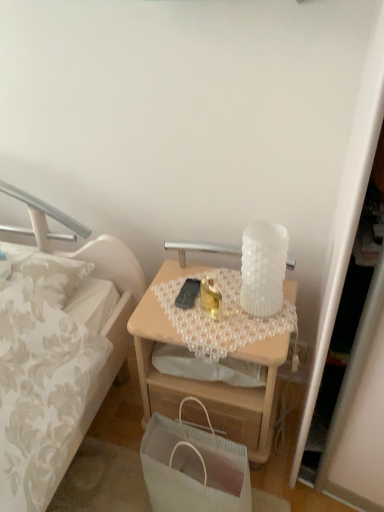
Describe the element at coordinates (253, 265) in the screenshot. I see `white textured glass at upper center` at that location.

I want to click on light wood desk at center, so click(x=207, y=381).

Identify the location of white ribbed paper bag at lower center. (193, 468).

From the picture: Considering the relative positions of light wood desk at center and white ribbed paper bag at lower center in the image provided, is light wood desk at center to the right of white ribbed paper bag at lower center from the viewer's perspective?

Yes.

From the image's perspective, does light wood desk at center appear lower than white ribbed paper bag at lower center?

Incorrect, from the image's perspective, light wood desk at center is higher than white ribbed paper bag at lower center.

Between point (142, 387) and point (165, 429), which one is positioned in front?

Point (165, 429)

How different are the orientations of light wood desk at center and white ribbed paper bag at lower center in degrees?

The angle between the facing direction of light wood desk at center and the facing direction of white ribbed paper bag at lower center is 1.5 degrees.

Does point (181, 305) come farther from viewer compared to point (146, 462)?

That is True.

Can you confirm if black matte mobile phone at center is wider than white ribbed paper bag at lower center?

No, black matte mobile phone at center is not wider than white ribbed paper bag at lower center.

The height and width of the screenshot is (512, 384). In order to click on handbag lying on the right of black matte mobile phone at center in this screenshot , I will do `click(193, 468)`.

In the image, is black matte mobile phone at center positioned in front of or behind white ribbed paper bag at lower center?

black matte mobile phone at center is positioned farther from the viewer than white ribbed paper bag at lower center.

Considering the positions of point (178, 441) and point (184, 297), is point (178, 441) closer or farther from the camera than point (184, 297)?

Point (178, 441).

From the image's perspective, is white ribbed paper bag at lower center located above or below black matte mobile phone at center?

From the image's perspective, white ribbed paper bag at lower center appears below black matte mobile phone at center.

Which is in front, white ribbed paper bag at lower center or black matte mobile phone at center?

Positioned in front is white ribbed paper bag at lower center.

Can you confirm if white ribbed paper bag at lower center is wider than black matte mobile phone at center?

Correct, the width of white ribbed paper bag at lower center exceeds that of black matte mobile phone at center.

Is there a large distance between white textured glass at upper center and white ribbed paper bag at lower center?

No, white textured glass at upper center is in close proximity to white ribbed paper bag at lower center.

Image resolution: width=384 pixels, height=512 pixels. In order to click on handbag below the white textured glass at upper center (from a real-world perspective) in this screenshot , I will do `click(193, 468)`.

Considering the relative positions of white textured glass at upper center and white ribbed paper bag at lower center in the image provided, is white textured glass at upper center in front of white ribbed paper bag at lower center?

No, it is behind white ribbed paper bag at lower center.

Is white textured glass at upper center facing away from white ribbed paper bag at lower center?

No, white textured glass at upper center is not facing away from white ribbed paper bag at lower center.

Is light wood desk at center oriented away from white textured glass at upper center?

That's not correct — light wood desk at center is not looking away from white textured glass at upper center.

From a real-world perspective, is light wood desk at center located higher than white textured glass at upper center?

No.

Does light wood desk at center appear on the left side of white textured glass at upper center?

Yes, light wood desk at center is to the left of white textured glass at upper center.

Does light wood desk at center lie behind white textured glass at upper center?

That is False.

Can you confirm if white ribbed paper bag at lower center is thinner than white textured glass at upper center?

No.

Based on the photo, from the image's perspective, is white ribbed paper bag at lower center located above or below white textured glass at upper center?

From the image's perspective, white ribbed paper bag at lower center appears below white textured glass at upper center.

Is white ribbed paper bag at lower center oriented away from white textured glass at upper center?

No, white ribbed paper bag at lower center's orientation is not away from white textured glass at upper center.

Is white ribbed paper bag at lower center to the left of white textured glass at upper center from the viewer's perspective?

Yes.

Find the location of `mobile phone above the light wood desk at center (from a real-world perspective)`. mobile phone above the light wood desk at center (from a real-world perspective) is located at coordinates (188, 294).

Considering the points (179, 297) and (167, 380), which point is behind, point (179, 297) or point (167, 380)?

Point (167, 380)

From the picture: From their relative heights in the image, would you say black matte mobile phone at center is taller or shorter than light wood desk at center?

Clearly, black matte mobile phone at center is shorter compared to light wood desk at center.

In the scene shown: Does black matte mobile phone at center have a lesser width compared to light wood desk at center?

Yes.

Image resolution: width=384 pixels, height=512 pixels. Find the location of `desk behind the white ribbed paper bag at lower center`. desk behind the white ribbed paper bag at lower center is located at coordinates (207, 381).

You are a GUI agent. You are given a task and a screenshot of the screen. Output one action in this format:
    pyautogui.click(x=<x>, y=<y>)
    Task: Click on the mobile phone above the white ribbed paper bag at lower center (from a real-world perspective)
    The width and height of the screenshot is (384, 512).
    Given the screenshot: What is the action you would take?
    [x=188, y=294]

Based on their spatial positions, is white ribbed paper bag at lower center or white textured glass at upper center further from light wood desk at center?

white textured glass at upper center.

Which object lies nearer to the anchor point white ribbed paper bag at lower center, white textured glass at upper center or light wood desk at center?

Based on the image, light wood desk at center appears to be nearer to white ribbed paper bag at lower center.

From the picture: When comparing their distances from black matte mobile phone at center, does white ribbed paper bag at lower center or light wood desk at center seem closer?

Based on the image, light wood desk at center appears to be nearer to black matte mobile phone at center.

Estimate the real-world distances between objects in this image. Which object is closer to black matte mobile phone at center, light wood desk at center or white textured glass at upper center?

white textured glass at upper center lies closer to black matte mobile phone at center than the other object.

Looking at the image, which one is located further to light wood desk at center, white ribbed paper bag at lower center or black matte mobile phone at center?

black matte mobile phone at center lies further to light wood desk at center than the other object.

From the image, which object appears to be farther from white textured glass at upper center, light wood desk at center or white ribbed paper bag at lower center?

white ribbed paper bag at lower center.

When comparing their distances from white ribbed paper bag at lower center, does black matte mobile phone at center or white textured glass at upper center seem further?

white textured glass at upper center.

Which object lies nearer to the anchor point black matte mobile phone at center, white textured glass at upper center or light wood desk at center?

Among the two, white textured glass at upper center is located nearer to black matte mobile phone at center.

This screenshot has height=512, width=384. What are the coordinates of `desk between black matte mobile phone at center and white ribbed paper bag at lower center from top to bottom` in the screenshot? It's located at (207, 381).

The height and width of the screenshot is (512, 384). I want to click on desk between white textured glass at upper center and white ribbed paper bag at lower center from top to bottom, so click(x=207, y=381).

Locate an element on the screen. This screenshot has height=512, width=384. mobile phone between white textured glass at upper center and white ribbed paper bag at lower center in the up-down direction is located at coordinates (188, 294).

Locate an element on the screen. The image size is (384, 512). mobile phone between white textured glass at upper center and light wood desk at center from top to bottom is located at coordinates (188, 294).